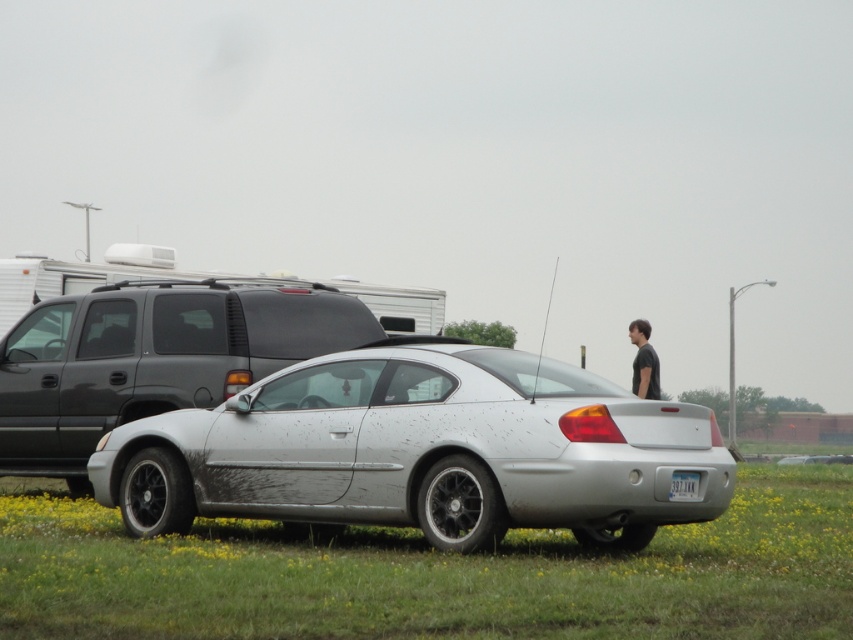
You are a delivery person trying to find the address of the recipient. You see the green grass at lower center and the white plastic license plate at center. Which object is closer to the left side of your view?

The green grass at lower center is positioned on the left side of the white plastic license plate at center, so the green grass at lower center is closer to the left side of your view.